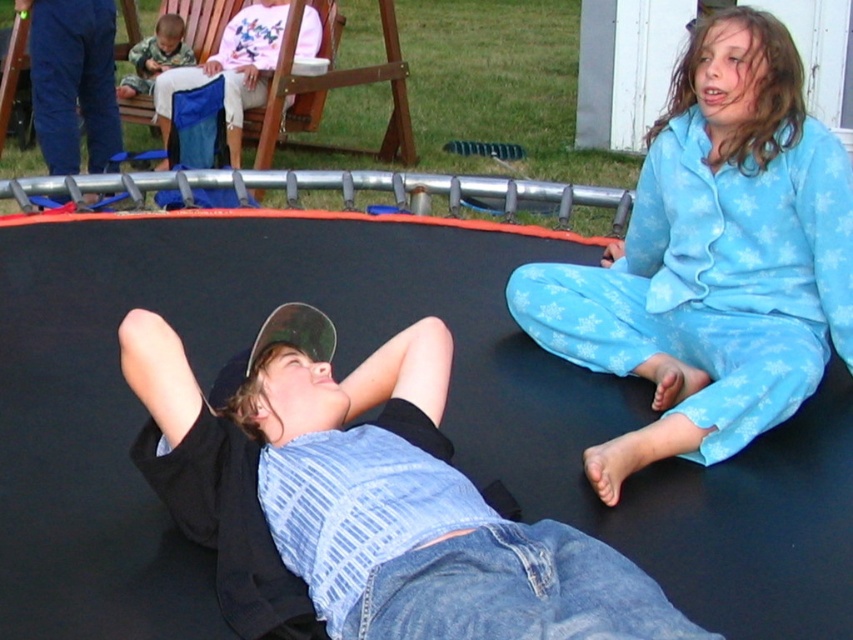
Which is more to the left, denim shirt at center or camouflage fabric shirt at upper left?

From the viewer's perspective, camouflage fabric shirt at upper left appears more on the left side.

Between point (590, 577) and point (161, 29), which one is positioned in front?

Point (590, 577) is more forward.

Between point (206, 534) and point (169, 49), which one is positioned in front?

Point (206, 534)

Locate an element on the screen. This screenshot has width=853, height=640. denim shirt at center is located at coordinates (366, 504).

The image size is (853, 640). What do you see at coordinates (712, 259) in the screenshot?
I see `blue fleece pajamas at upper right` at bounding box center [712, 259].

This screenshot has height=640, width=853. What do you see at coordinates (712, 259) in the screenshot?
I see `blue fleece pajamas at upper right` at bounding box center [712, 259].

This screenshot has height=640, width=853. Identify the location of blue fleece pajamas at upper right. (712, 259).

Can you confirm if denim shirt at center is shorter than blue fleece pajamas at upper right?

Correct, denim shirt at center is not as tall as blue fleece pajamas at upper right.

Who is higher up, denim shirt at center or blue fleece pajamas at upper right?

Positioned higher is blue fleece pajamas at upper right.

Between point (387, 515) and point (741, 400), which one is positioned behind?

Positioned behind is point (741, 400).

Locate an element on the screen. This screenshot has width=853, height=640. denim shirt at center is located at coordinates (366, 504).